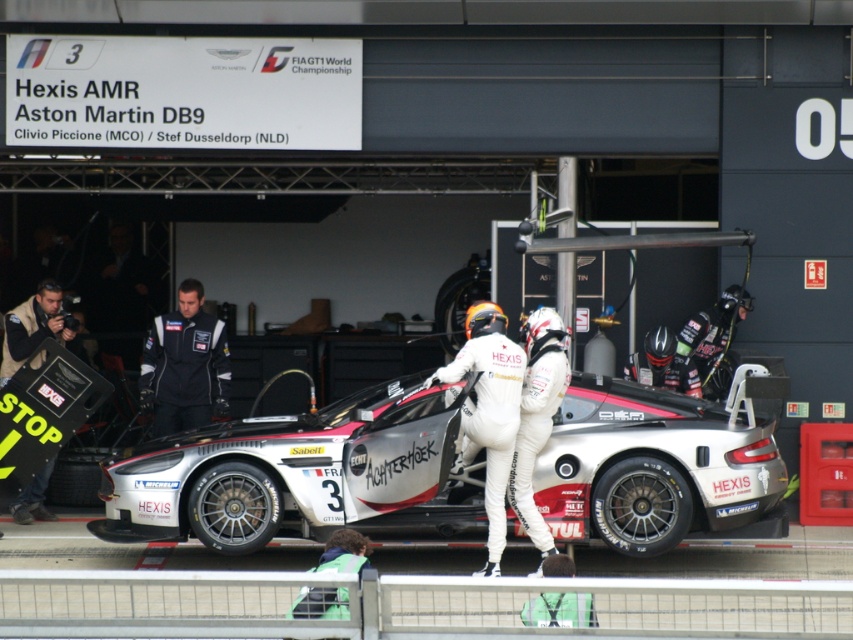
Question: Among these points, which one is nearest to the camera?

Choices:
 (A) (22, 301)
 (B) (584, 417)

Answer: (B)

Question: Considering the relative positions of silver metallic race car at center and khaki jacket at left in the image provided, where is silver metallic race car at center located with respect to khaki jacket at left?

Choices:
 (A) left
 (B) right

Answer: (B)

Question: Which of these objects is positioned closest to the khaki jacket at left?

Choices:
 (A) silver metallic race car at center
 (B) black fabric suit at center

Answer: (B)

Question: Can you confirm if silver metallic race car at center is positioned to the left of khaki jacket at left?

Choices:
 (A) no
 (B) yes

Answer: (A)

Question: Can you confirm if silver metallic race car at center is positioned to the right of black fabric suit at center?

Choices:
 (A) yes
 (B) no

Answer: (A)

Question: Among these objects, which one is nearest to the camera?

Choices:
 (A) khaki jacket at left
 (B) black fabric suit at center
 (C) silver metallic race car at center

Answer: (C)